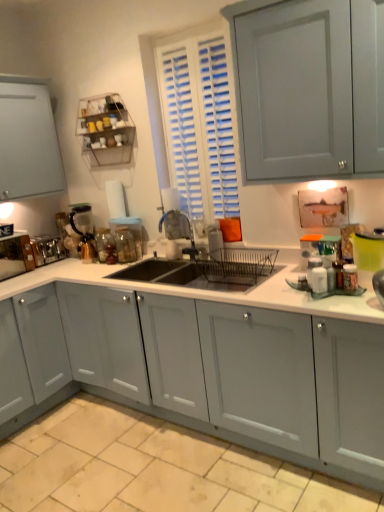
Question: Are beige tile at lower center and translucent glass coffee maker at left, which is the second appliance from right to left, located far from each other?

Choices:
 (A) yes
 (B) no

Answer: (A)

Question: Is beige tile at lower center positioned with its back to translucent glass coffee maker at left, which is the second appliance from right to left?

Choices:
 (A) yes
 (B) no

Answer: (B)

Question: Can you confirm if beige tile at lower center is wider than translucent glass coffee maker at left, acting as the 3th appliance starting from the left?

Choices:
 (A) yes
 (B) no

Answer: (A)

Question: From the image's perspective, is beige tile at lower center below translucent glass coffee maker at left, acting as the 3th appliance starting from the left?

Choices:
 (A) yes
 (B) no

Answer: (A)

Question: Can you confirm if beige tile at lower center is thinner than translucent glass coffee maker at left, acting as the 3th appliance starting from the left?

Choices:
 (A) yes
 (B) no

Answer: (B)

Question: Does beige tile at lower center come behind translucent glass coffee maker at left, acting as the 3th appliance starting from the left?

Choices:
 (A) yes
 (B) no

Answer: (B)

Question: Is satin silver toaster at left, which is the 3th appliance from right to left, surrounded by white matte countertop at center?

Choices:
 (A) no
 (B) yes

Answer: (A)

Question: Is white matte countertop at center facing towards satin silver toaster at left, which is the 3th appliance from right to left?

Choices:
 (A) yes
 (B) no

Answer: (B)

Question: From the image's perspective, does white matte countertop at center appear lower than satin silver toaster at left, the second appliance from the left?

Choices:
 (A) yes
 (B) no

Answer: (A)

Question: From a real-world perspective, does white matte countertop at center sit lower than satin silver toaster at left, the second appliance from the left?

Choices:
 (A) no
 (B) yes

Answer: (B)

Question: From the image's perspective, is white matte countertop at center over satin silver toaster at left, the second appliance from the left?

Choices:
 (A) no
 (B) yes

Answer: (A)

Question: Does white matte countertop at center have a smaller size compared to satin silver toaster at left, which is the 3th appliance from right to left?

Choices:
 (A) no
 (B) yes

Answer: (A)

Question: Considering the relative sizes of white matte countertop at center and clear glass jar at sink, placed as the fourth appliance when sorted from left to right, in the image provided, is white matte countertop at center thinner than clear glass jar at sink, placed as the fourth appliance when sorted from left to right,?

Choices:
 (A) yes
 (B) no

Answer: (B)